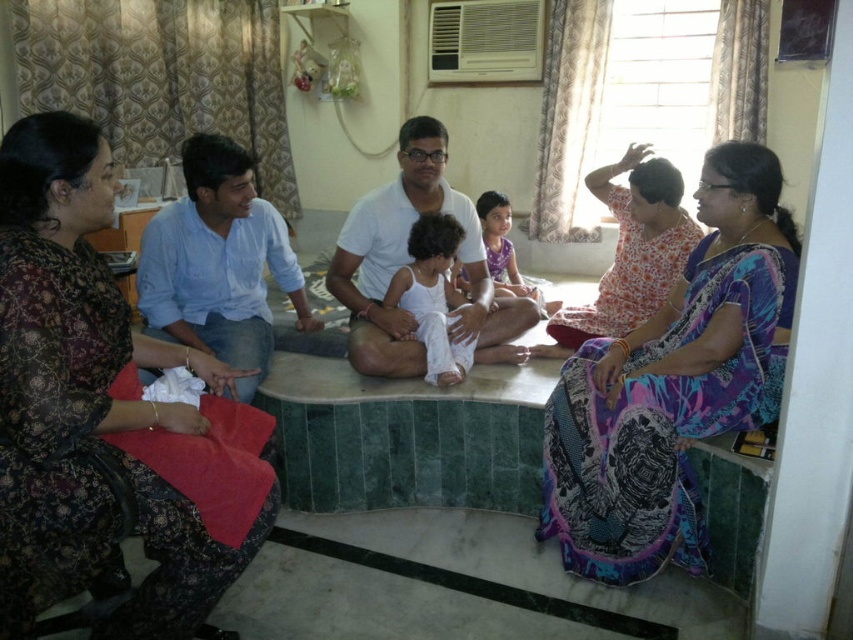
Does printed silk saree at right have a smaller size compared to floral print dress at upper right?

Actually, printed silk saree at right might be larger than floral print dress at upper right.

Between printed silk saree at right and floral print dress at upper right, which one has more height?

With more height is printed silk saree at right.

Which is in front, point (683, 550) or point (627, 227)?

Point (683, 550) is more forward.

This screenshot has height=640, width=853. I want to click on printed silk saree at right, so point(672,384).

Who is more distant from viewer, (x=54, y=323) or (x=469, y=301)?

Positioned behind is point (x=469, y=301).

Between dark floral dress at left and white cotton shirt at center, which one appears on the left side from the viewer's perspective?

dark floral dress at left is more to the left.

Identify the location of dark floral dress at left. (90, 410).

Find the location of `dark floral dress at left`. dark floral dress at left is located at coordinates (90, 410).

Is dark floral dress at left thinner than printed silk saree at right?

Yes.

Does dark floral dress at left lie behind printed silk saree at right?

No, it is not.

Who is more forward, [164,538] or [785,252]?

Point [164,538]

Where is `dark floral dress at left`? dark floral dress at left is located at coordinates (90, 410).